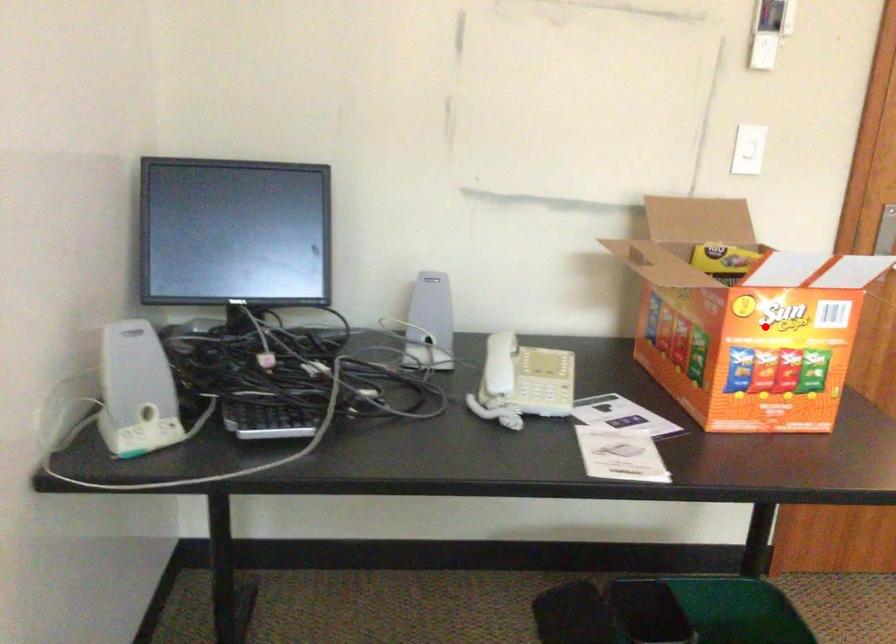
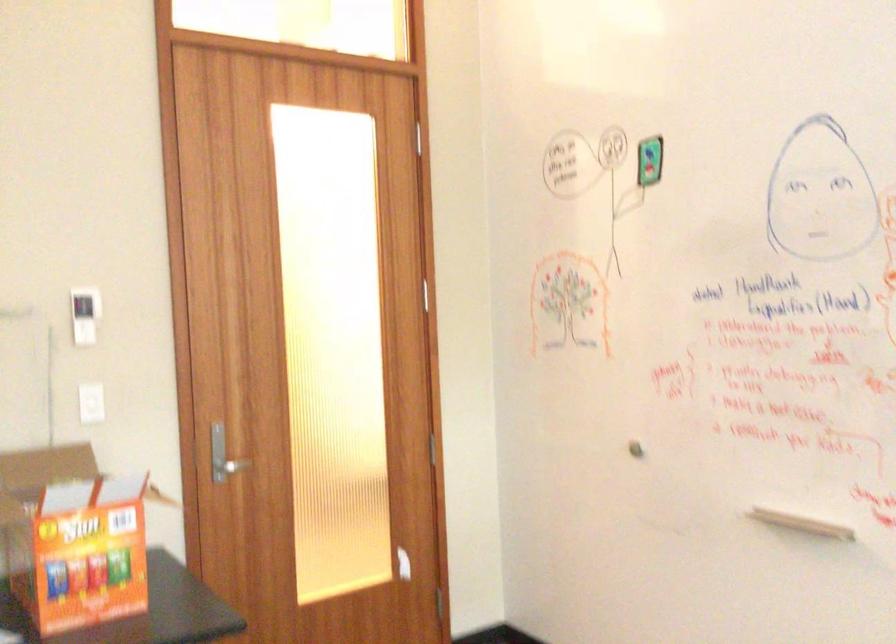
Question: I am providing you with two images of the same scene from different viewpoints. Image1 has a red point marked. In image2, the corresponding 3D location appears at what relative position? Reply with the corresponding letter.

Choices:
 (A) Closer
 (B) Farther

Answer: (B)